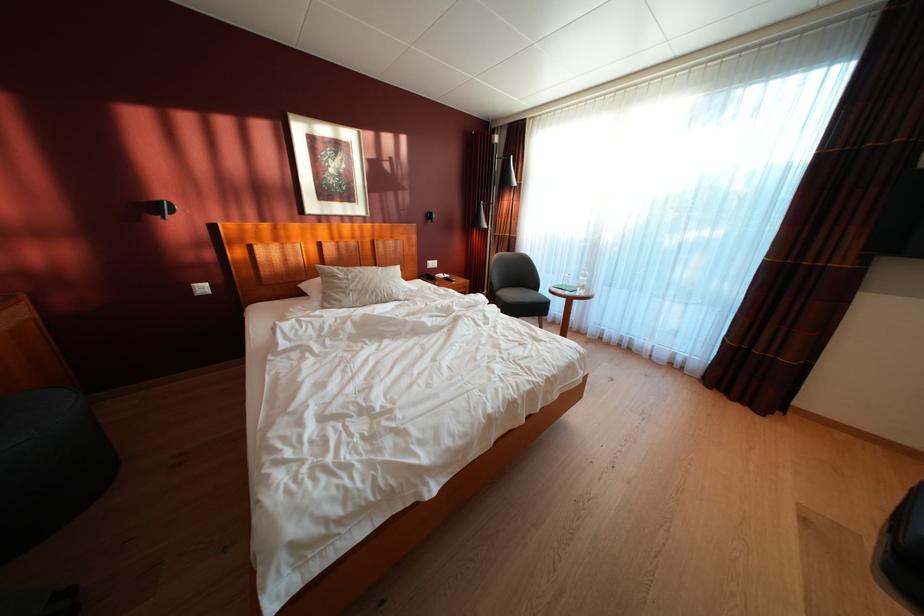
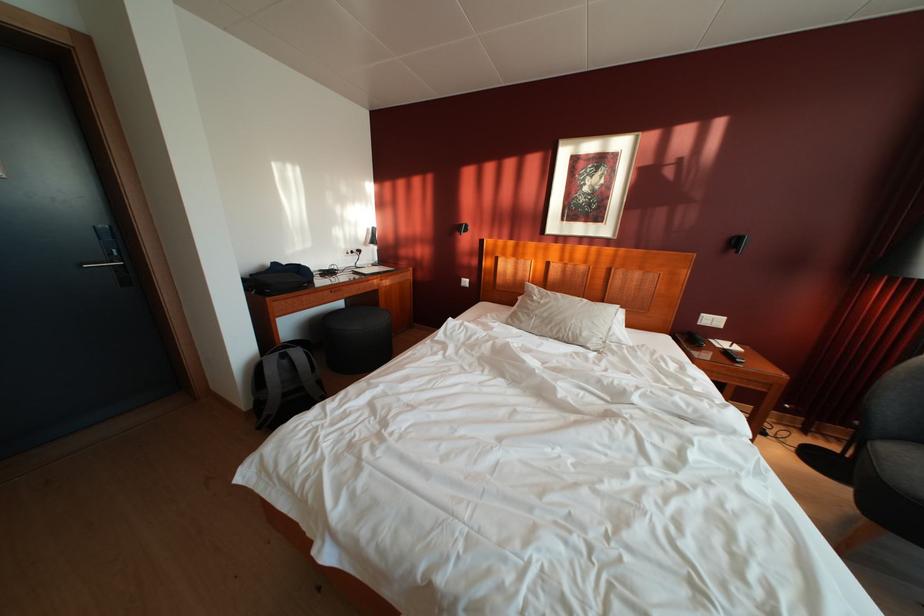
Locate, in the second image, the point that corresponds to point (450, 282) in the first image.

(732, 350)